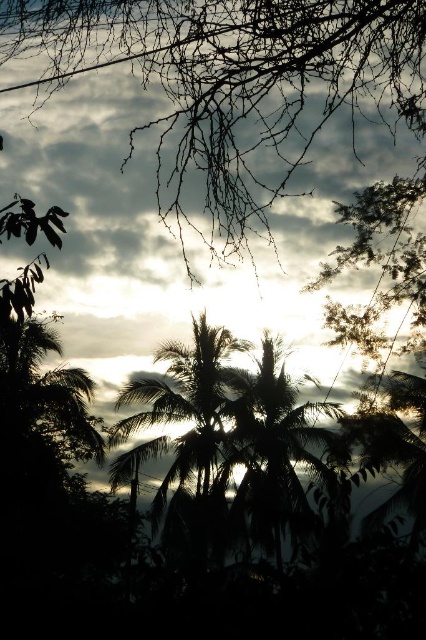
You are an astronomer analyzing the image. You need to locate the cloudy sky at upper center. What are its coordinates?

The cloudy sky at upper center is located at coordinates point (x=233, y=84).

You are planning to hang a 12 feet long decorative banner between the silhouette leafy palm at center and the silhouette palm tree at center. Can you fit the banner between them without needing to adjust their positions?

The distance between the silhouette leafy palm at center and the silhouette palm tree at center is 14.10 feet, which is greater than the 12 feet length of the banner. Therefore, the banner can be hung between them without needing to adjust their positions.